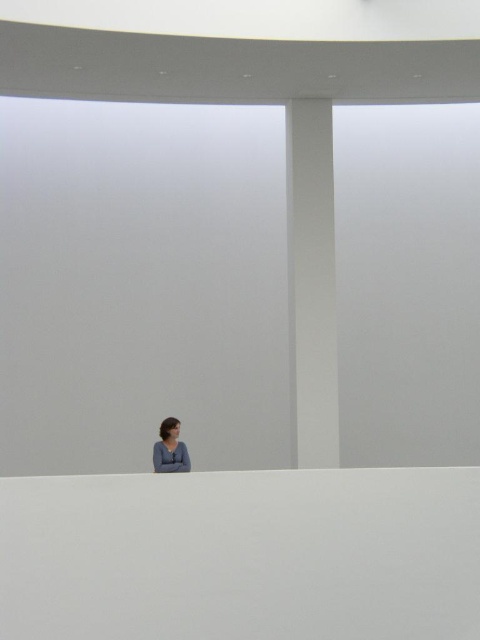
Question: Among these objects, which one is farthest from the camera?

Choices:
 (A) matte gray sweater at lower center
 (B) white smooth pillar at right

Answer: (B)

Question: Is white smooth pillar at right further to camera compared to matte gray sweater at lower center?

Choices:
 (A) yes
 (B) no

Answer: (A)

Question: Among these objects, which one is farthest from the camera?

Choices:
 (A) white smooth pillar at right
 (B) matte gray sweater at lower center

Answer: (A)

Question: Does white smooth pillar at right have a lesser width compared to matte gray sweater at lower center?

Choices:
 (A) yes
 (B) no

Answer: (B)

Question: Is white smooth pillar at right wider than matte gray sweater at lower center?

Choices:
 (A) no
 (B) yes

Answer: (B)

Question: Which point is closer to the camera?

Choices:
 (A) white smooth pillar at right
 (B) matte gray sweater at lower center

Answer: (B)